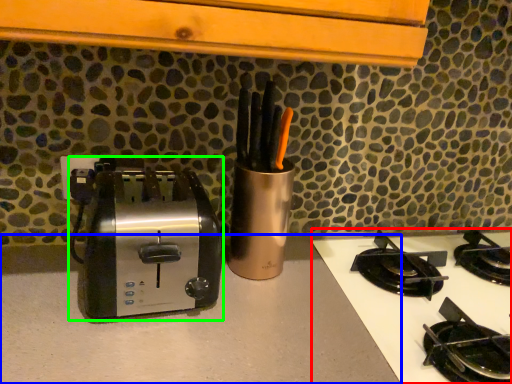
Question: Which object is positioned farthest from gas stove (highlighted by a red box)? Select from counter top (highlighted by a blue box) and toaster (highlighted by a green box).

Choices:
 (A) counter top
 (B) toaster

Answer: (B)